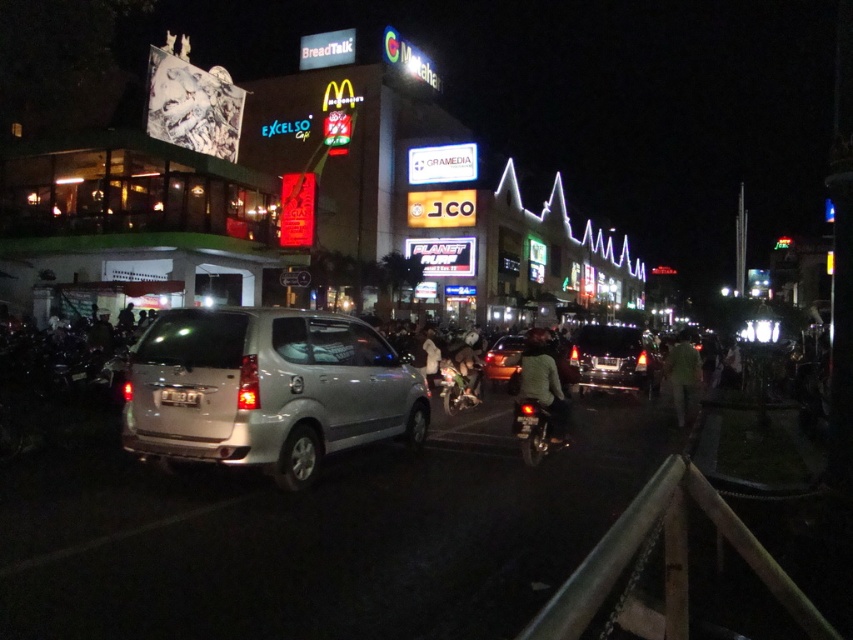
You are a delivery rider on a metallic silver motorcycle at center. You need to make a quick turn to avoid a pedestrian. Which direction should you turn to avoid the green fabric person at right?

The green fabric person at right is in front of the metallic silver motorcycle at center, so the rider should turn to the left to avoid them.

You are a photographer standing on the street and see the green fabric jacket at center and the white fabric person at center. Which one is shorter in height?

The green fabric jacket at center is shorter in height compared to the white fabric person at center.

Consider the image. You are standing at the camera position and want to find the green fabric person at right. According to the scene description, where should you look to find them?

The green fabric person at right is located at the 2D coordinates point (682,374) in the image.